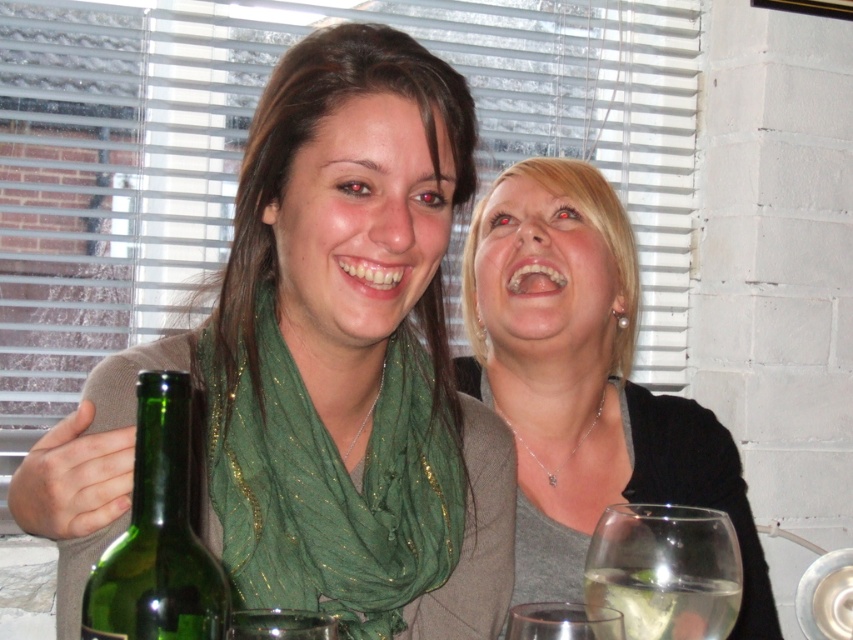
What are the coordinates of the green shimmering scarf at center?

The green shimmering scarf at center is located at coordinates (331, 483).